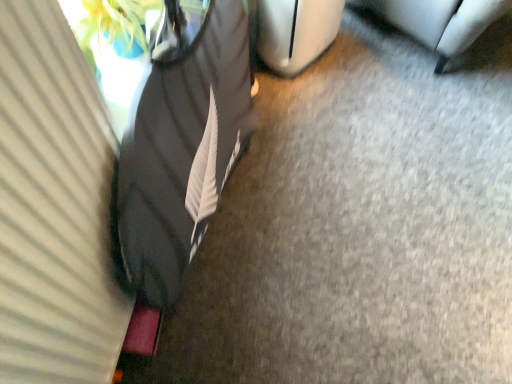
Question: Considering their positions, is black fabric bean bag chair at left located in front of or behind metallic silver trash can at lower right?

Choices:
 (A) behind
 (B) front

Answer: (B)

Question: Considering the positions of black fabric bean bag chair at left and metallic silver trash can at lower right in the image, is black fabric bean bag chair at left taller or shorter than metallic silver trash can at lower right?

Choices:
 (A) short
 (B) tall

Answer: (B)

Question: Considering the real-world distances, which object is closest to the metallic silver trash can at lower right?

Choices:
 (A) white matte curtain at left
 (B) black fabric bean bag chair at left

Answer: (B)

Question: Estimate the real-world distances between objects in this image. Which object is farther from the metallic silver trash can at lower right?

Choices:
 (A) white matte curtain at left
 (B) black fabric bean bag chair at left

Answer: (A)